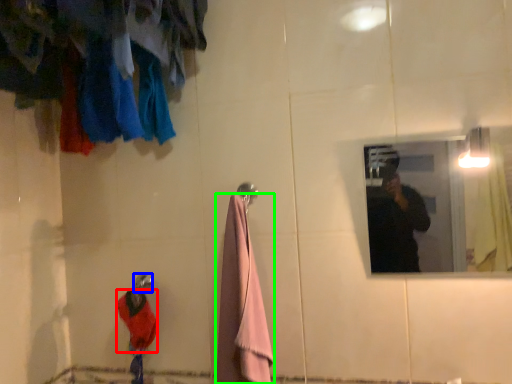
Question: Estimate the real-world distances between objects in this image. Which object is farther from clothing (highlighted by a red box), shower (highlighted by a blue box) or towel/napkin (highlighted by a green box)?

Choices:
 (A) shower
 (B) towel/napkin

Answer: (B)